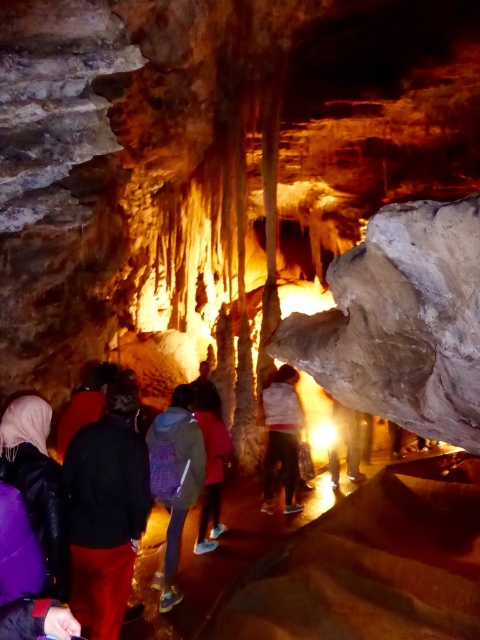
You are part of the cave exploration team and need to retrieve an item from your purple fabric backpack at center. However, there is an obstacle blocking your path. You notice the dark brown leather jacket at lower left nearby. Can you move the jacket to access your backpack?

The purple fabric backpack at center is closer to the viewer than the dark brown leather jacket at lower left, meaning the jacket is farther away. Since the jacket is not in front of the backpack, moving it won

You are part of the cave exploration group and need to hand a map to the person wearing the dark brown leather jacket at lower left. The map is currently in the purple fabric backpack at center. Which direction should you move to retrieve the backpack before approaching the jacket?

The purple fabric backpack at center is to the right of the dark brown leather jacket at lower left. To retrieve the backpack, you should move to the right side of the jacket, then bring the map back to the left to reach the jacket.